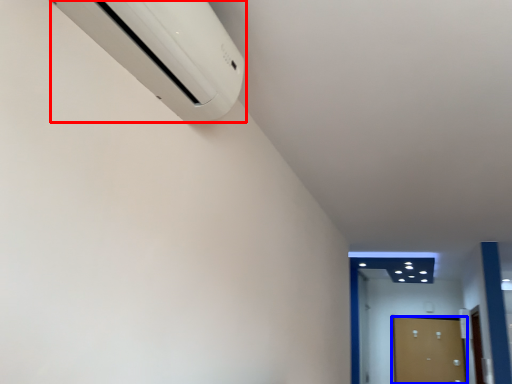
Question: Which point is closer to the camera, home appliance (highlighted by a red box) or door (highlighted by a blue box)?

Choices:
 (A) home appliance
 (B) door

Answer: (A)